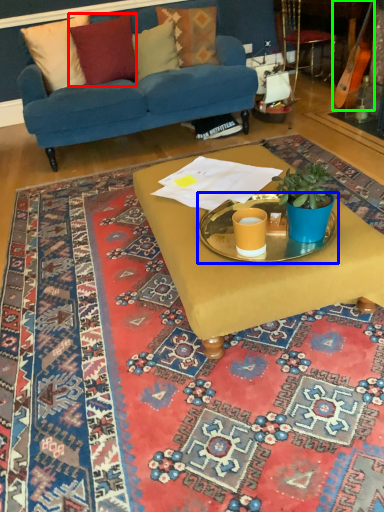
Question: Based on their relative distances, which object is farther from pillow (highlighted by a red box)? Choose from round table (highlighted by a blue box) and instrument (highlighted by a green box).

Choices:
 (A) round table
 (B) instrument

Answer: (A)